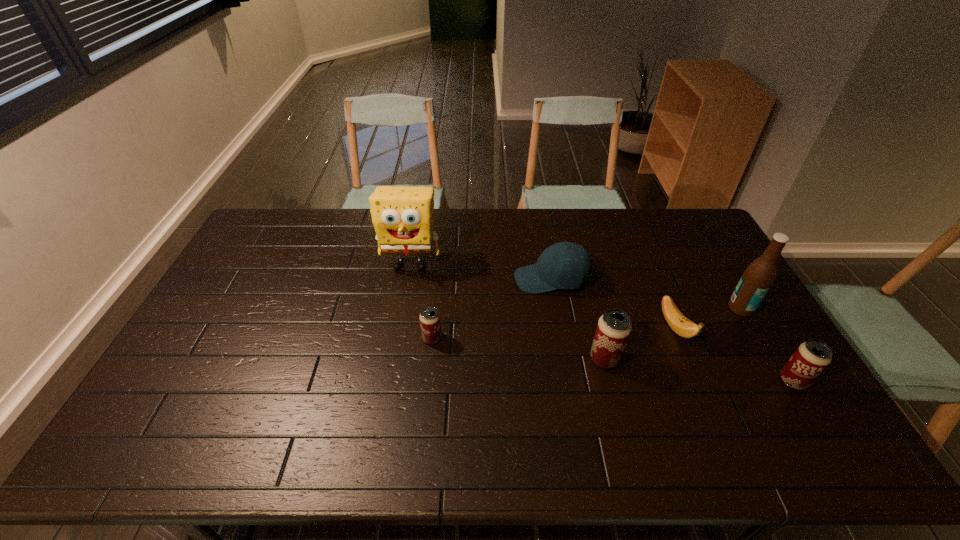
You are a GUI agent. You are given a task and a screenshot of the screen. Output one action in this format:
    pyautogui.click(x=<x>, y=<y>)
    Task: Click on the free spot between the beer bottle and the tallest beer can
    Image resolution: width=960 pixels, height=540 pixels.
    Given the screenshot: What is the action you would take?
    pyautogui.click(x=673, y=333)

Image resolution: width=960 pixels, height=540 pixels. I want to click on empty space between the baseball cap and the second tallest beer can, so click(x=672, y=330).

Image resolution: width=960 pixels, height=540 pixels. Identify the location of free spot between the baseball cap and the tallest beer can. (578, 319).

At what (x,y) coordinates should I click in order to perform the action: click on vacant point located between the sponge and the second beer can from left to right. Please return your answer as a coordinate pair (x, y). The image size is (960, 540). Looking at the image, I should click on (508, 311).

The height and width of the screenshot is (540, 960). I want to click on free area in between the second beer can from left to right and the baseball cap, so click(x=578, y=319).

Locate an element on the screen. vacant point located between the rightmost beer can and the tallest beer can is located at coordinates [699, 370].

The width and height of the screenshot is (960, 540). I want to click on the third closest object relative to the second beer can from right to left, so click(x=756, y=281).

Locate an element on the screen. This screenshot has width=960, height=540. object that is the third closest to the second beer can from right to left is located at coordinates (756, 281).

You are a GUI agent. You are given a task and a screenshot of the screen. Output one action in this format:
    pyautogui.click(x=<x>, y=<y>)
    Task: Click on the closest beer can relative to the sponge
    Image resolution: width=960 pixels, height=540 pixels.
    Given the screenshot: What is the action you would take?
    pyautogui.click(x=430, y=324)

Choose which beer can is the nearest neighbor to the sponge. Please provide its 2D coordinates. Your answer should be formatted as a tuple, i.e. [(x, y)], where the tuple contains the x and y coordinates of a point satisfying the conditions above.

[(430, 324)]